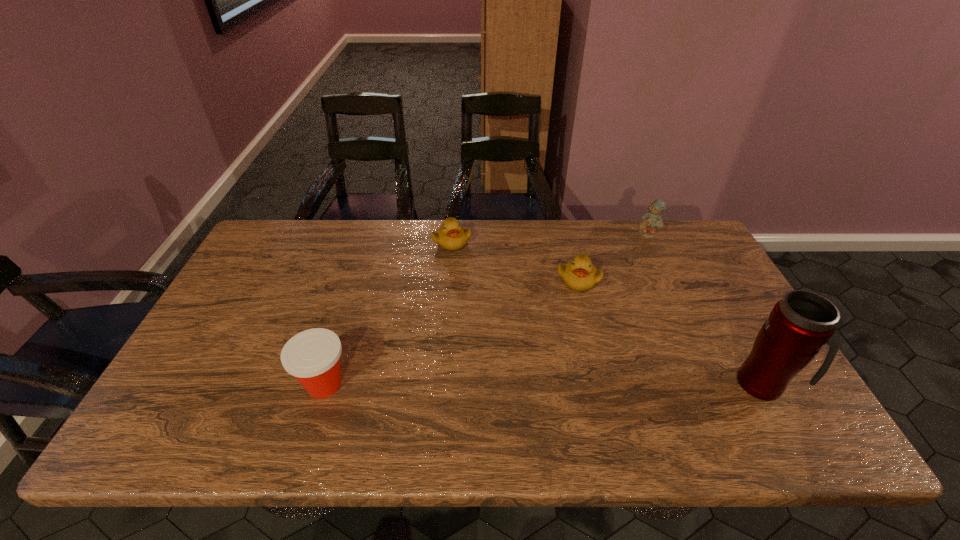
Where is `Dixie cup present at the near edge`? This screenshot has height=540, width=960. Dixie cup present at the near edge is located at coordinates (312, 356).

I want to click on thermos bottle positioned at the near edge, so click(802, 322).

Locate an element on the screen. The width and height of the screenshot is (960, 540). thermos bottle at the right edge is located at coordinates pyautogui.click(x=802, y=322).

Find the location of a particular element. This screenshot has width=960, height=540. teddy bear that is positioned at the right edge is located at coordinates (651, 220).

Locate an element on the screen. This screenshot has height=540, width=960. object present at the far right corner is located at coordinates (651, 220).

Locate an element on the screen. object that is at the near right corner is located at coordinates (802, 322).

The image size is (960, 540). What are the coordinates of `free space at the far edge` in the screenshot? It's located at (341, 251).

Identify the location of free region at the near edge. (502, 388).

Find the location of a particular element. This screenshot has height=540, width=960. vacant point at the left edge is located at coordinates (248, 348).

I want to click on free space at the right edge of the desktop, so point(721,343).